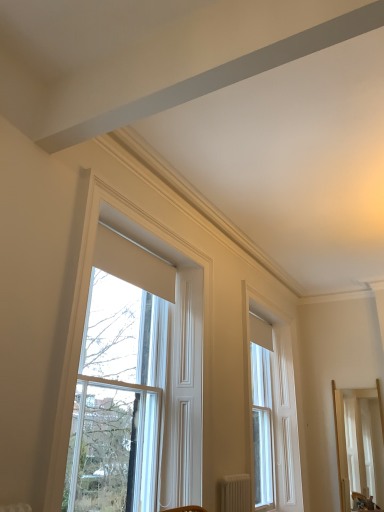
Locate an element on the screen. The height and width of the screenshot is (512, 384). white wood window at center, acting as the 2th window starting from the front is located at coordinates (280, 401).

Identify the location of white matte radiator at lower center. This screenshot has width=384, height=512. (235, 493).

Locate an element on the screen. The image size is (384, 512). light wood mirror at right is located at coordinates (359, 444).

Consider the image. From a real-world perspective, who is located lower, white matte radiator at lower center or white wood window at upper center, which ranks as the first window in front-to-back order?

white matte radiator at lower center is physically lower.

Which point is more distant from viewer, (243, 505) or (110, 510)?

The point (243, 505) is behind.

Is white matte radiator at lower center positioned with its back to white wood window at upper center, which ranks as the first window in front-to-back order?

white matte radiator at lower center is not turned away from white wood window at upper center, which ranks as the first window in front-to-back order.

Is white matte radiator at lower center further to the viewer compared to white wood window at upper center, which ranks as the first window in front-to-back order?

Yes.

Is white wood window at center, acting as the 2th window starting from the front, wider or thinner than white wood window at upper center, arranged as the 2th window when viewed from the back?

In the image, white wood window at center, acting as the 2th window starting from the front, appears to be more narrow than white wood window at upper center, arranged as the 2th window when viewed from the back.

From their relative heights in the image, would you say white wood window at center, acting as the 2th window starting from the front, is taller or shorter than white wood window at upper center, which ranks as the first window in left-to-right order?

Considering their sizes, white wood window at center, acting as the 2th window starting from the front, has more height than white wood window at upper center, which ranks as the first window in left-to-right order.

Is white wood window at center, the 1th window from the right, oriented towards white wood window at upper center, which ranks as the first window in left-to-right order?

No, white wood window at center, the 1th window from the right, is not facing towards white wood window at upper center, which ranks as the first window in left-to-right order.

Is white wood window at center, which ranks as the first window in back-to-front order, situated inside white wood window at upper center, which is the second window in right-to-left order, or outside?

white wood window at center, which ranks as the first window in back-to-front order, is located beyond the bounds of white wood window at upper center, which is the second window in right-to-left order.

At what (x,y) coordinates should I click in order to perform the action: click on radiator below the light wood mirror at right (from a real-world perspective). Please return your answer as a coordinate pair (x, y). This screenshot has height=512, width=384. Looking at the image, I should click on (235, 493).

Which of these two, white matte radiator at lower center or light wood mirror at right, is smaller?

Smaller between the two is white matte radiator at lower center.

Are white matte radiator at lower center and light wood mirror at right located far from each other?

white matte radiator at lower center is positioned a significant distance from light wood mirror at right.

Does white matte radiator at lower center appear on the left side of light wood mirror at right?

Yes.

Consider the image. From a real-world perspective, is white wood window at center, acting as the 2th window starting from the front, physically located above or below white matte radiator at lower center?

white wood window at center, acting as the 2th window starting from the front, is above white matte radiator at lower center.

Between point (293, 371) and point (238, 496), which one is positioned in front?

The point (238, 496) is closer.

Who is shorter, white wood window at center, which ranks as the first window in back-to-front order, or white matte radiator at lower center?

With less height is white matte radiator at lower center.

Looking at this image, is the surface of white wood window at center, acting as the 2th window starting from the front, in direct contact with white matte radiator at lower center?

No, white wood window at center, acting as the 2th window starting from the front, is not with white matte radiator at lower center.

This screenshot has height=512, width=384. I want to click on radiator lying below the white wood window at center, acting as the 2th window starting from the front (from the image's perspective), so click(x=235, y=493).

Would you say white matte radiator at lower center is inside or outside white wood window at center, which ranks as the first window in back-to-front order?

white matte radiator at lower center cannot be found inside white wood window at center, which ranks as the first window in back-to-front order.

Considering the positions of objects white matte radiator at lower center and white wood window at center, which ranks as the first window in back-to-front order, in the image provided, who is more to the left, white matte radiator at lower center or white wood window at center, which ranks as the first window in back-to-front order,?

white matte radiator at lower center is more to the left.

Considering the points (244, 500) and (295, 361), which point is in front, point (244, 500) or point (295, 361)?

The point (244, 500) is more forward.

Would you say white wood window at center, which ranks as the first window in back-to-front order, is part of light wood mirror at right's contents?

No, white wood window at center, which ranks as the first window in back-to-front order, is located outside of light wood mirror at right.

Could you tell me if light wood mirror at right is turned towards white wood window at center, acting as the 2th window starting from the front?

No, light wood mirror at right is not turned towards white wood window at center, acting as the 2th window starting from the front.

Considering the sizes of objects light wood mirror at right and white wood window at center, which ranks as the first window in back-to-front order, in the image provided, who is shorter, light wood mirror at right or white wood window at center, which ranks as the first window in back-to-front order,?

Standing shorter between the two is light wood mirror at right.

Can you confirm if light wood mirror at right is positioned to the right of white wood window at center, acting as the 2th window starting from the front?

Correct, you'll find light wood mirror at right to the right of white wood window at center, acting as the 2th window starting from the front.

Which of these two, white wood window at upper center, which ranks as the first window in left-to-right order, or light wood mirror at right, is smaller?

With smaller size is light wood mirror at right.

Does white wood window at upper center, arranged as the 2th window when viewed from the back, turn towards light wood mirror at right?

No, white wood window at upper center, arranged as the 2th window when viewed from the back, is not aimed at light wood mirror at right.

From the image's perspective, is white wood window at upper center, which ranks as the first window in left-to-right order, located beneath light wood mirror at right?

No, from the image's perspective, white wood window at upper center, which ranks as the first window in left-to-right order, is not below light wood mirror at right.

Identify the location of the 2nd window directly above the white matte radiator at lower center (from a real-world perspective). Image resolution: width=384 pixels, height=512 pixels. (118, 384).

Identify the location of window lying on the right of white wood window at upper center, which ranks as the first window in front-to-back order. (280, 401).

Which object lies further to the anchor point light wood mirror at right, white wood window at upper center, which ranks as the first window in left-to-right order, or white matte radiator at lower center?

white wood window at upper center, which ranks as the first window in left-to-right order, lies further to light wood mirror at right than the other object.

Estimate the real-world distances between objects in this image. Which object is further from white wood window at center, which ranks as the first window in back-to-front order, white wood window at upper center, which is the second window in right-to-left order, or white matte radiator at lower center?

Based on the image, white wood window at upper center, which is the second window in right-to-left order, appears to be further to white wood window at center, which ranks as the first window in back-to-front order.

Which object lies nearer to the anchor point white matte radiator at lower center, light wood mirror at right or white wood window at center, positioned as the second window in left-to-right order?

The object closer to white matte radiator at lower center is white wood window at center, positioned as the second window in left-to-right order.

Based on their spatial positions, is white matte radiator at lower center or white wood window at upper center, arranged as the 2th window when viewed from the back, closer to light wood mirror at right?

Among the two, white matte radiator at lower center is located nearer to light wood mirror at right.

Based on their spatial positions, is white wood window at center, acting as the 2th window starting from the front, or light wood mirror at right closer to white wood window at upper center, which ranks as the first window in front-to-back order?

white wood window at center, acting as the 2th window starting from the front, is positioned closer to the anchor white wood window at upper center, which ranks as the first window in front-to-back order.

Based on their spatial positions, is white wood window at center, positioned as the second window in left-to-right order, or white matte radiator at lower center further from light wood mirror at right?

Among the two, white matte radiator at lower center is located further to light wood mirror at right.

When comparing their distances from white wood window at upper center, which is the second window in right-to-left order, does white matte radiator at lower center or white wood window at center, acting as the 2th window starting from the front, seem further?

Based on the image, white wood window at center, acting as the 2th window starting from the front, appears to be further to white wood window at upper center, which is the second window in right-to-left order.

When comparing their distances from white matte radiator at lower center, does white wood window at center, the 1th window from the right, or white wood window at upper center, arranged as the 2th window when viewed from the back, seem further?

Based on the image, white wood window at center, the 1th window from the right, appears to be further to white matte radiator at lower center.

I want to click on window between white wood window at upper center, which is the second window in right-to-left order, and light wood mirror at right in the front-back direction, so click(280, 401).

I want to click on window located between white matte radiator at lower center and light wood mirror at right in the left-right direction, so click(x=280, y=401).

I want to click on radiator positioned between white wood window at upper center, which ranks as the first window in front-to-back order, and light wood mirror at right from near to far, so click(x=235, y=493).

This screenshot has height=512, width=384. Find the location of `radiator between white wood window at upper center, which ranks as the first window in front-to-back order, and white wood window at center, which ranks as the first window in back-to-front order, along the z-axis`. radiator between white wood window at upper center, which ranks as the first window in front-to-back order, and white wood window at center, which ranks as the first window in back-to-front order, along the z-axis is located at coordinates (235, 493).